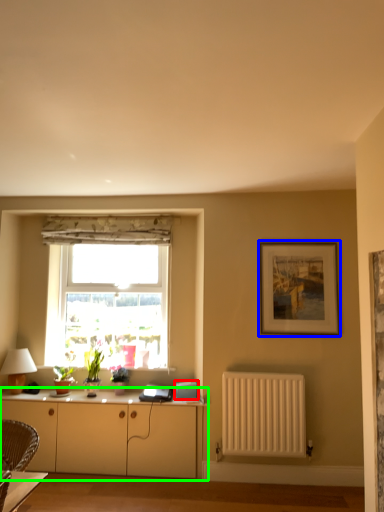
Question: Estimate the real-world distances between objects in this image. Which object is closer to appliance (highlighted by a red box), picture frame (highlighted by a blue box) or cabinetry (highlighted by a green box)?

Choices:
 (A) picture frame
 (B) cabinetry

Answer: (B)